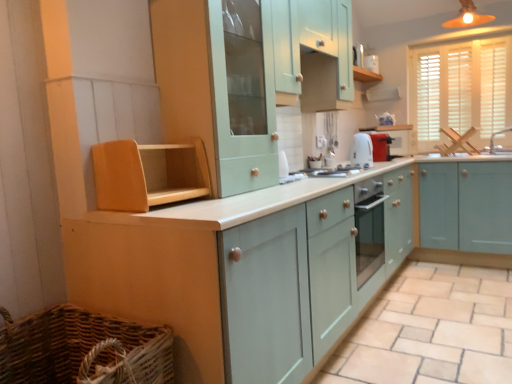
Where is `woven brown basket at lower left`? This screenshot has width=512, height=384. woven brown basket at lower left is located at coordinates (83, 349).

Where is `white ceramic sink at right`? This screenshot has width=512, height=384. white ceramic sink at right is located at coordinates (495, 136).

What do you see at coordinates (382, 92) in the screenshot?
I see `white glossy exhaust hood at upper center` at bounding box center [382, 92].

In order to click on mint green wood cabinet at upper center, the third cabinetry positioned from the right in this screenshot , I will do `click(314, 52)`.

Describe the element at coordinates (468, 16) in the screenshot. The height and width of the screenshot is (384, 512). I see `matte orange light fixture at upper right` at that location.

I want to click on white wood blinds at upper right, so click(461, 88).

Find the location of `woven brown basket at lower left`. woven brown basket at lower left is located at coordinates (83, 349).

Is point (191, 183) in front of point (382, 93)?

Yes, it is in front of point (382, 93).

From the picture: Does wooden shelf at left, the 5th cabinetry viewed from the right, have a larger size compared to white glossy exhaust hood at upper center?

Yes, wooden shelf at left, the 5th cabinetry viewed from the right, is bigger than white glossy exhaust hood at upper center.

Find the location of a particular element. exhaust hood that appears behind the wooden shelf at left, the first cabinetry viewed from the left is located at coordinates (382, 92).

Looking at this image, which is correct: wooden shelf at left, the first cabinetry viewed from the left, is inside white glossy exhaust hood at upper center, or outside of it?

wooden shelf at left, the first cabinetry viewed from the left, is spatially situated outside white glossy exhaust hood at upper center.

Is white glossy exhaust hood at upper center facing towards light beige tile at lower center?

No, white glossy exhaust hood at upper center does not turn towards light beige tile at lower center.

Between white glossy exhaust hood at upper center and light beige tile at lower center, which one has smaller width?

white glossy exhaust hood at upper center is thinner.

Which is in front, white glossy exhaust hood at upper center or light beige tile at lower center?

light beige tile at lower center is in front.

Looking at this image, is white glossy exhaust hood at upper center in contact with light beige tile at lower center?

No, white glossy exhaust hood at upper center is not touching light beige tile at lower center.

Is point (474, 16) behind point (403, 155)?

No, (474, 16) is in front of (403, 155).

What's the angular difference between matte orange light fixture at upper right and matte red toaster at upper right, arranged as the third appliance when viewed from the front,'s facing directions?

The angular difference between matte orange light fixture at upper right and matte red toaster at upper right, arranged as the third appliance when viewed from the front, is 43.6 degrees.

Between matte orange light fixture at upper right and matte red toaster at upper right, which appears as the 1th appliance when viewed from the back, which one has larger width?

With larger width is matte orange light fixture at upper right.

From a real-world perspective, is matte orange light fixture at upper right physically located above or below matte red toaster at upper right, arranged as the third appliance when viewed from the front?

From a real-world perspective, matte orange light fixture at upper right is physically above matte red toaster at upper right, arranged as the third appliance when viewed from the front.

How many degrees apart are the facing directions of mint green wood cabinets at right, which is the fifth cabinetry in left-to-right order, and light beige tile at lower center?

The angle between the facing direction of mint green wood cabinets at right, which is the fifth cabinetry in left-to-right order, and the facing direction of light beige tile at lower center is 0.161 degrees.

Starting from the light beige tile at lower center, which cabinetry is the 3rd one behind? Please provide its 2D coordinates.

[(464, 213)]

Is mint green wood cabinets at right, which is the fifth cabinetry in left-to-right order, turned away from light beige tile at lower center?

No, mint green wood cabinets at right, which is the fifth cabinetry in left-to-right order, is not facing the opposite direction of light beige tile at lower center.

Between mint green wood cabinets at right, which is the fifth cabinetry in left-to-right order, and light beige tile at lower center, which one has smaller width?

With smaller width is mint green wood cabinets at right, which is the fifth cabinetry in left-to-right order.

From the image's perspective, between mint green wood cabinets at right, which is counted as the 1th cabinetry, starting from the right, and matte white toaster at center, which appears as the 2th appliance when viewed from the back, which one is located above?

matte white toaster at center, which appears as the 2th appliance when viewed from the back, appears higher in the image.

Can we say mint green wood cabinets at right, which is the fifth cabinetry in left-to-right order, lies outside matte white toaster at center, which appears as the 2th appliance when viewed from the back?

That's correct, mint green wood cabinets at right, which is the fifth cabinetry in left-to-right order, is outside of matte white toaster at center, which appears as the 2th appliance when viewed from the back.

In terms of height, does mint green wood cabinets at right, which is counted as the 1th cabinetry, starting from the right, look taller or shorter compared to matte white toaster at center, marked as the 2th appliance in a front-to-back arrangement?

Considering their sizes, mint green wood cabinets at right, which is counted as the 1th cabinetry, starting from the right, has more height than matte white toaster at center, marked as the 2th appliance in a front-to-back arrangement.

Which object is further away from the camera, mint green wood cabinets at right, which is counted as the 1th cabinetry, starting from the right, or matte white toaster at center, marked as the 2th appliance in a front-to-back arrangement?

matte white toaster at center, marked as the 2th appliance in a front-to-back arrangement, is more distant.

Consider the image. From the image's perspective, which one is positioned lower, matte white toaster at center, which appears as the 2th appliance when viewed from the back, or matte orange light fixture at upper right?

matte white toaster at center, which appears as the 2th appliance when viewed from the back, is shown below in the image.

Is matte white toaster at center, which appears as the 2th appliance when viewed from the back, directly adjacent to matte orange light fixture at upper right?

matte white toaster at center, which appears as the 2th appliance when viewed from the back, and matte orange light fixture at upper right are not in contact.

From a real-world perspective, is matte white toaster at center, marked as the 2th appliance in a front-to-back arrangement, on matte orange light fixture at upper right?

No.

Which is closer, (433,208) or (312,68)?

Point (433,208).

Is mint green wood cabinets at right, which is counted as the 1th cabinetry, starting from the right, surrounding mint green wood cabinet at upper center, the third cabinetry positioned from the right?

No, mint green wood cabinet at upper center, the third cabinetry positioned from the right, is not inside mint green wood cabinets at right, which is counted as the 1th cabinetry, starting from the right.

From the image's perspective, which is below, mint green wood cabinets at right, which is counted as the 1th cabinetry, starting from the right, or mint green wood cabinet at upper center, which appears as the 3th cabinetry when viewed from the left?

mint green wood cabinets at right, which is counted as the 1th cabinetry, starting from the right, is shown below in the image.

Which of these two, mint green wood cabinets at right, which is the fifth cabinetry in left-to-right order, or mint green wood cabinet at upper center, the third cabinetry positioned from the right, is thinner?

mint green wood cabinet at upper center, the third cabinetry positioned from the right, is thinner.

There is a wooden shelf at left, the first cabinetry viewed from the left. Where is `exhaust hood above it (from a real-world perspective)`? This screenshot has width=512, height=384. exhaust hood above it (from a real-world perspective) is located at coordinates (382, 92).

What are the coordinates of `tile below the white glossy exhaust hood at upper center (from the image's perspective)` in the screenshot? It's located at (432, 330).

From the image, which object appears to be nearer to matte white toaster at center, marked as the 2th appliance in a front-to-back arrangement, white glossy exhaust hood at upper center or white glossy toaster at center, the 1th appliance in the front-to-back sequence?

white glossy toaster at center, the 1th appliance in the front-to-back sequence, is closer to matte white toaster at center, marked as the 2th appliance in a front-to-back arrangement.

When comparing their distances from wooden shelf at left, the 5th cabinetry viewed from the right, does mint green wood cabinet at upper center, which is the fourth cabinetry from right to left, or matte orange light fixture at upper right seem further?

Among the two, matte orange light fixture at upper right is located further to wooden shelf at left, the 5th cabinetry viewed from the right.

When comparing their distances from light beige tile at lower center, does matte red toaster at upper right, arranged as the third appliance when viewed from the front, or mint green wood cabinet at upper center, which appears as the 3th cabinetry when viewed from the left, seem further?

mint green wood cabinet at upper center, which appears as the 3th cabinetry when viewed from the left, is positioned further to the anchor light beige tile at lower center.

When comparing their distances from matte white toaster at center, marked as the 2th appliance in a front-to-back arrangement, does mint green wood cabinets at right, which is the fifth cabinetry in left-to-right order, or wooden shelf at left, the first cabinetry viewed from the left, seem closer?

Based on the image, mint green wood cabinets at right, which is the fifth cabinetry in left-to-right order, appears to be nearer to matte white toaster at center, marked as the 2th appliance in a front-to-back arrangement.

Looking at the image, which one is located closer to white glossy toaster at center, the 1th appliance in the front-to-back sequence, metallic silver gas stove at center or matte teal cabinet at center, the second cabinetry viewed from the right?

The object closer to white glossy toaster at center, the 1th appliance in the front-to-back sequence, is metallic silver gas stove at center.

Estimate the real-world distances between objects in this image. Which object is closer to white ceramic sink at right, white glossy exhaust hood at upper center or white wood blinds at upper right?

white wood blinds at upper right.

Estimate the real-world distances between objects in this image. Which object is further from white glossy toaster at center, arranged as the 3th appliance when viewed from the back, woven brown basket at lower left or matte orange light fixture at upper right?

Among the two, woven brown basket at lower left is located further to white glossy toaster at center, arranged as the 3th appliance when viewed from the back.

Estimate the real-world distances between objects in this image. Which object is further from white ceramic sink at right, light beige tile at lower center or matte red toaster at upper right, which appears as the 1th appliance when viewed from the back?

light beige tile at lower center lies further to white ceramic sink at right than the other object.

Locate an element on the screen. appliance between light beige tile at lower center and mint green wood cabinets at right, which is counted as the 1th cabinetry, starting from the right, in the front-back direction is located at coordinates (361, 150).

You are a GUI agent. You are given a task and a screenshot of the screen. Output one action in this format:
    pyautogui.click(x=<x>, y=<y>)
    Task: Click on the cabinetry located between white glossy toaster at center, arranged as the 3th appliance when viewed from the back, and white wood blinds at upper right in the left-right direction
    
    Given the screenshot: What is the action you would take?
    pyautogui.click(x=464, y=213)

The height and width of the screenshot is (384, 512). I want to click on window between mint green wood cabinet at upper center, placed as the 2th cabinetry when sorted from left to right, and white glossy exhaust hood at upper center, along the z-axis, so click(461, 88).

Find the location of a particular element. The image size is (512, 384). sink between woven brown basket at lower left and white wood blinds at upper right along the z-axis is located at coordinates (495, 136).